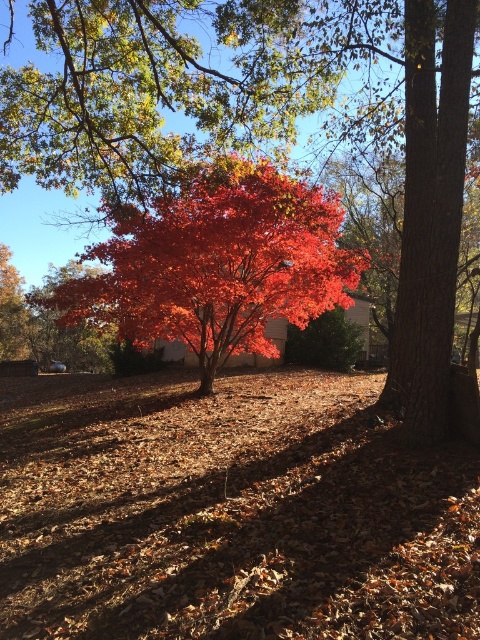
You are an artist planning to paint the autumn scene. You have two maple trees in the image, the shiny red maple tree at center and the glossy red maple at center. Which one should you paint larger to accurately represent their sizes in the scene?

The shiny red maple tree at center is larger in size than the glossy red maple at center, so you should paint the shiny red maple tree at center larger to accurately represent their sizes in the scene.

In the autumn scene, there are two maple trees at the center. The first is labeled as the shiny red maple tree at center, and the second is the glossy red maple at center. Which of these two trees is taller?

The shiny red maple tree at center is taller than the glossy red maple at center according to the description.